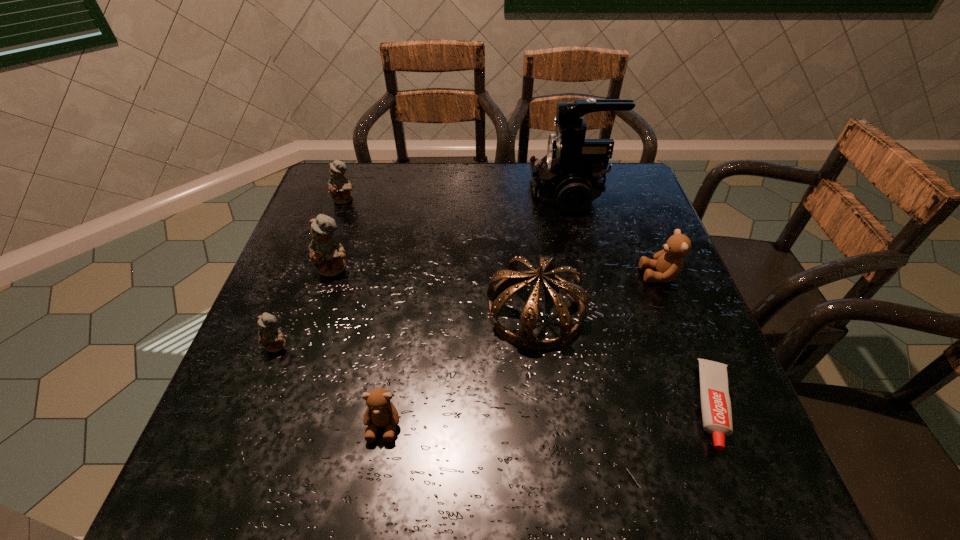
Identify the location of the fifth object from right to left. This screenshot has width=960, height=540. (381, 412).

You are a GUI agent. You are given a task and a screenshot of the screen. Output one action in this format:
    pyautogui.click(x=<x>, y=<y>)
    Task: Click on the nearest teddy bear
    Image resolution: width=960 pixels, height=540 pixels.
    Given the screenshot: What is the action you would take?
    pyautogui.click(x=381, y=412)

The width and height of the screenshot is (960, 540). I want to click on toothpaste, so (x=716, y=409).

Locate an element on the screen. This screenshot has height=540, width=960. vacant space located on the lens mount of the camcorder is located at coordinates (434, 193).

Locate an element on the screen. This screenshot has height=540, width=960. vacant space located on the lens mount of the camcorder is located at coordinates (430, 193).

Locate an element on the screen. The image size is (960, 540). vacant space located on the lens mount of the camcorder is located at coordinates (475, 193).

The image size is (960, 540). I want to click on blank area located on the front-facing side of the tallest teddy bear, so click(x=321, y=312).

Where is `free space located on the left of the brown tiara`? free space located on the left of the brown tiara is located at coordinates (445, 311).

Identify the location of blank space located on the front-facing side of the bigger brown teddy bear. This screenshot has width=960, height=540. point(505,275).

Where is `vacant region located 0.050m on the front-facing side of the bigger brown teddy bear`? vacant region located 0.050m on the front-facing side of the bigger brown teddy bear is located at coordinates (619, 275).